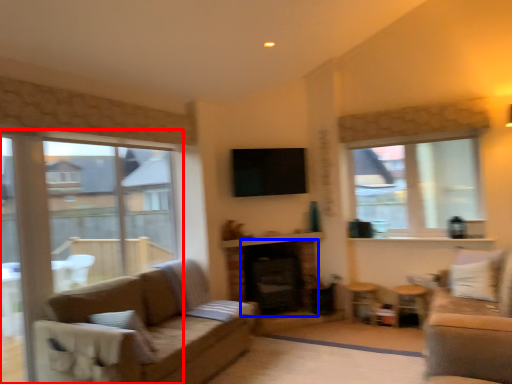
Question: Which object appears farthest to the camera in this image, window (highlighted by a red box) or fireplace (highlighted by a blue box)?

Choices:
 (A) window
 (B) fireplace

Answer: (B)